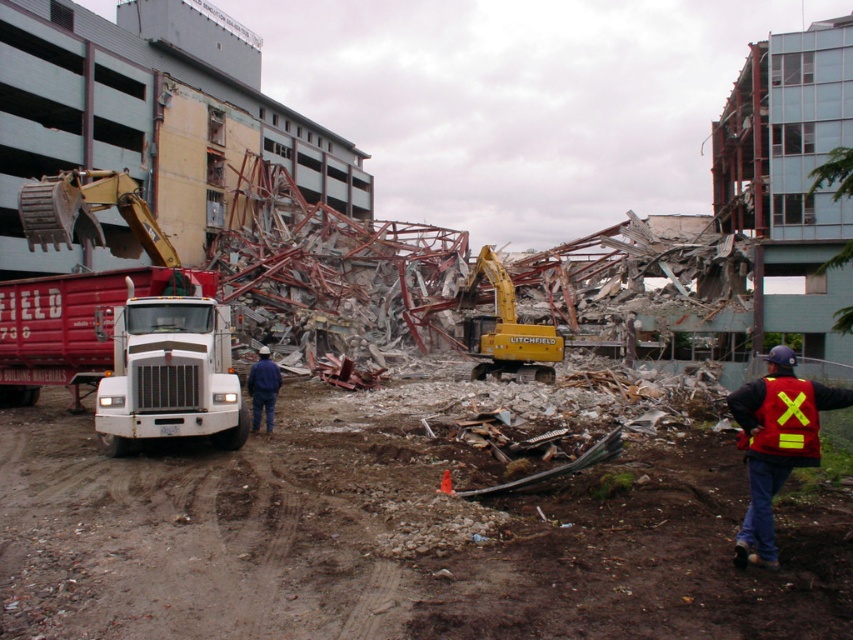
You are a safety inspector at the construction site. You notice the yellow rubber excavator at center and the blue denim jeans at center. Which object is bigger in size?

The yellow rubber excavator at center is larger in size than blue denim jeans at center.

You are a safety inspector on the construction site. You need to ensure that the yellow rubber excavator at center and the reflective red safety vest at lower right are positioned safely. Considering their widths, which object takes up more horizontal space?

The yellow rubber excavator at center takes up more horizontal space because its width surpasses that of the reflective red safety vest at lower right.

You are a safety inspector at the construction site. You need to ensure that all equipment is visible to workers. Given the yellow rubber excavator at center and the reflective red safety vest at lower right, which one is more likely to be easily seen from a distance?

The yellow rubber excavator at center is more likely to be easily seen from a distance because it has a larger size compared to the reflective red safety vest at lower right.